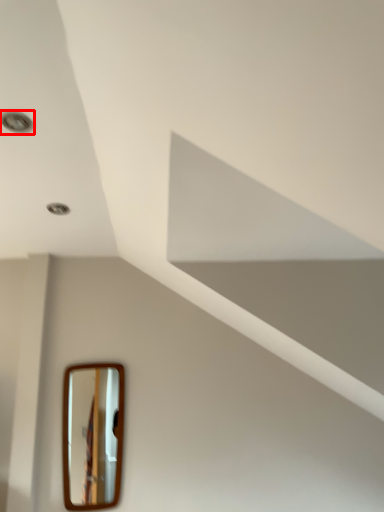
Question: From the image's perspective, what is the correct spatial positioning of droplight (annotated by the red box) in reference to mirror?

Choices:
 (A) below
 (B) above

Answer: (B)